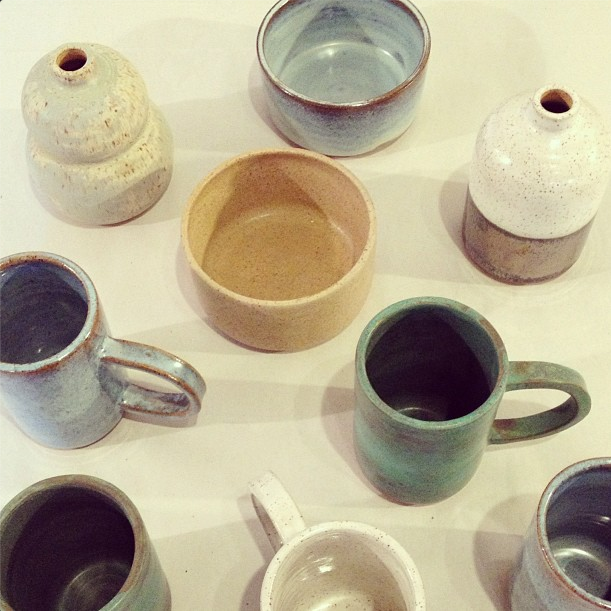
Where is `handle`? handle is located at coordinates (165, 363), (261, 496), (536, 371).